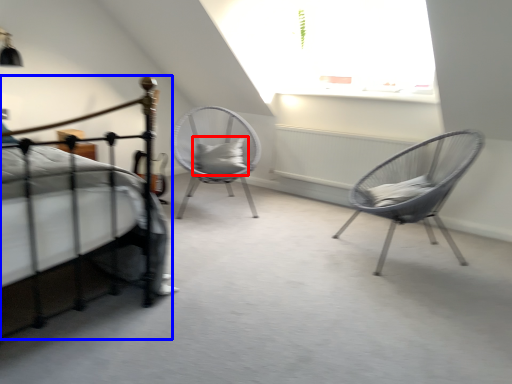
Question: Which object appears farthest to the camera in this image, pillow (highlighted by a red box) or bed (highlighted by a blue box)?

Choices:
 (A) pillow
 (B) bed

Answer: (A)